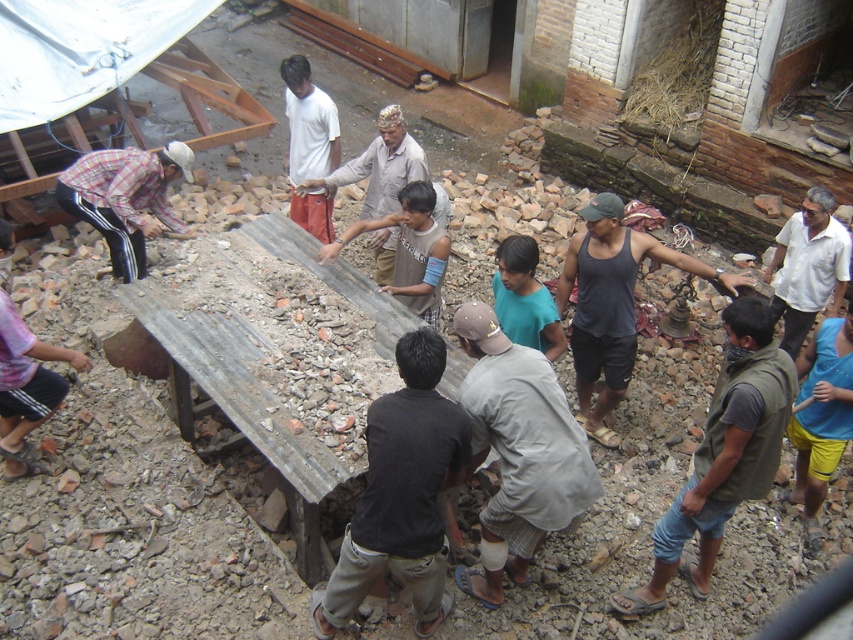
You are a safety inspector evaluating the workspace. You notice two workers wearing the dark gray tank top at center and the brown fabric shirt at center. Which worker is wearing clothing that might pose a safety hazard due to its larger size, potentially getting caught in machinery?

The dark gray tank top at center has a larger width than the brown fabric shirt at center, so it might pose a safety hazard as its larger size could get caught in machinery.

You are standing in the construction area and need to move from point A to point B. Point A is at coordinate point (599, 312) and point B is at coordinate point (320, 102). Since the ground is uneven and covered with debris, which point should you start from to have a shorter path to the other point?

You should start from point A at coordinate point (599, 312) because it is closer to the viewer than point B at coordinate point (320, 102), so the path between them is shorter.

You are a clothing designer observing the construction site. You notice two shirts in the scene, the dark gray tank top at center and the pink fabric shirt at lower left. Which shirt is larger in size?

The dark gray tank top at center is bigger than the pink fabric shirt at lower left.